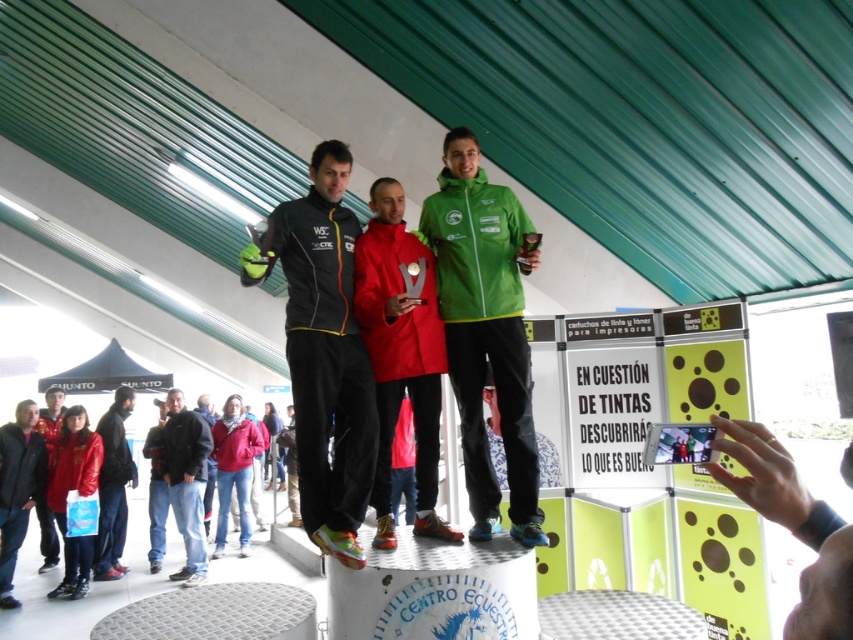
You are standing in front of the podium at the event. There are two points marked on the podium surface. The first point is at coordinates point (529, 536) and the second point is at point (199, 476). Which point is closer to you?

Point (529, 536) is closer to the camera than point (199, 476).

You are a photographer at the event and need to position your camera so that both the green matte jacket at center and the dark blue jacket at center are clearly visible. Given their heights, which jacket should you focus on first to ensure proper framing?

The green matte jacket at center is taller than the dark blue jacket at center, so you should focus on the green matte jacket at center first to account for its greater height in the frame.